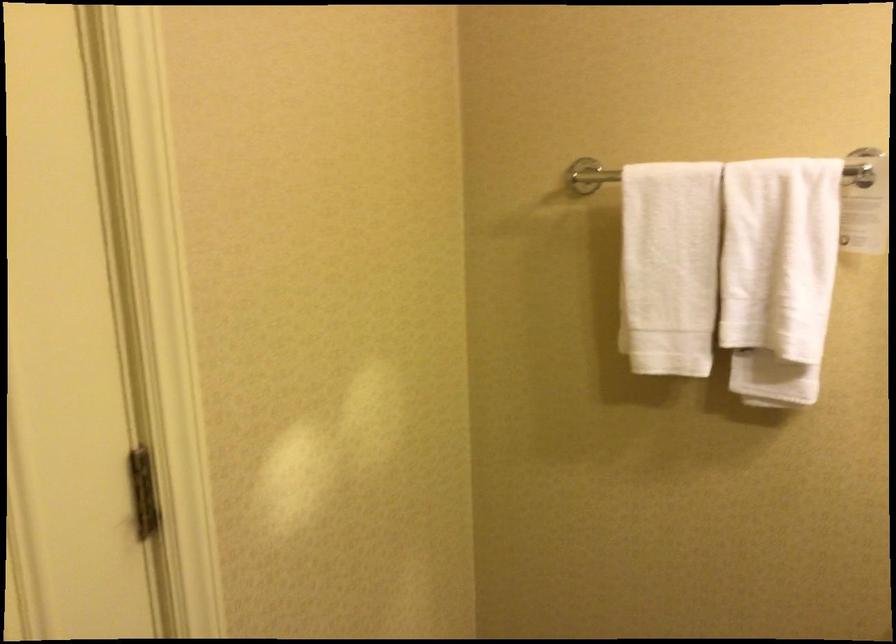
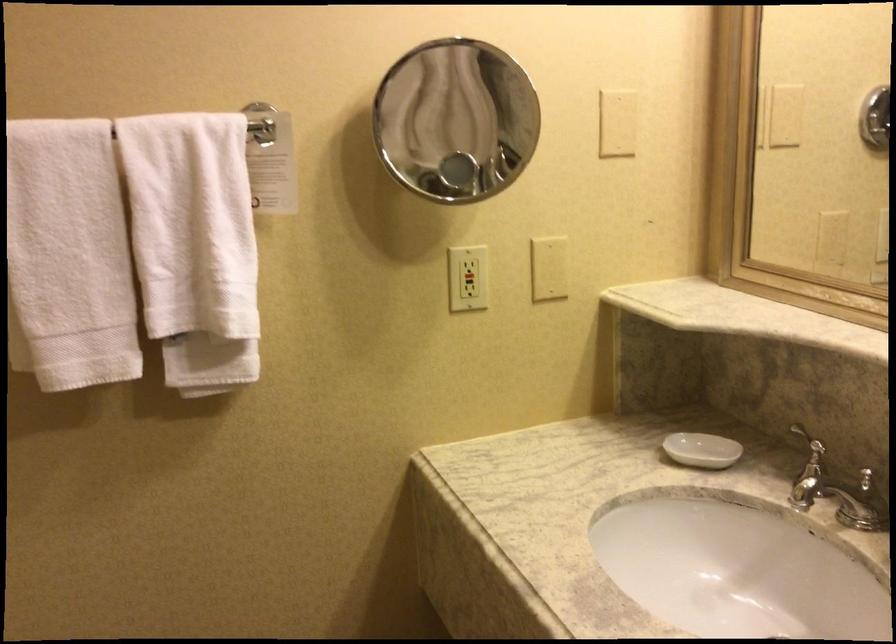
Where in the second image is the point corresponding to (777,272) from the first image?

(194, 245)